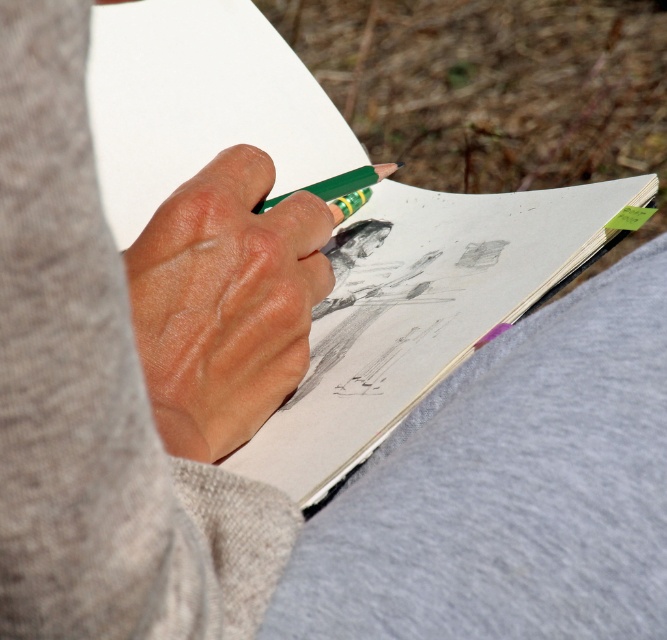
Question: Which object is closer to the camera taking this photo?

Choices:
 (A) matte gray sweater at upper left
 (B) green matte pencil at center
 (C) white paper at center
 (D) dry skin at center

Answer: (A)

Question: Can you confirm if matte gray sweater at upper left is positioned to the right of green matte pencil at center?

Choices:
 (A) no
 (B) yes

Answer: (A)

Question: Is matte gray sweater at upper left behind green matte pencil at center?

Choices:
 (A) yes
 (B) no

Answer: (B)

Question: Can you confirm if matte gray sweater at upper left is bigger than dry skin at center?

Choices:
 (A) yes
 (B) no

Answer: (B)

Question: Which point is farther to the camera?

Choices:
 (A) white paper at center
 (B) dry skin at center

Answer: (A)

Question: Estimate the real-world distances between objects in this image. Which object is farther from the white paper at center?

Choices:
 (A) green matte pencil at center
 (B) matte gray sweater at upper left

Answer: (B)